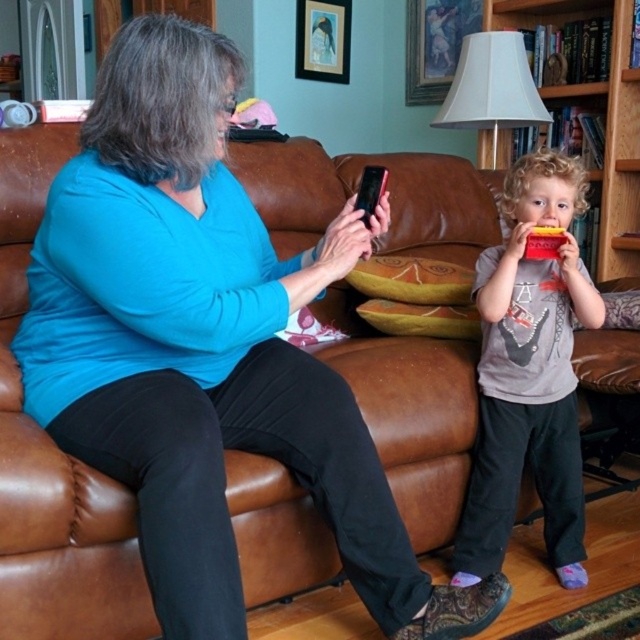
Question: Does brown leather couch at center have a larger size compared to wooden bookshelf at right?

Choices:
 (A) no
 (B) yes

Answer: (A)

Question: Where is brown leather couch at center located in relation to wooden bookshelf at right in the image?

Choices:
 (A) above
 (B) below

Answer: (B)

Question: Does brown leather couch at center lie behind gray cotton shirt at right?

Choices:
 (A) no
 (B) yes

Answer: (B)

Question: Which of these objects is positioned closest to the wooden bookshelf at right?

Choices:
 (A) brown leather couch at center
 (B) gray cotton shirt at right

Answer: (A)

Question: Which object is positioned farthest from the brown leather couch at center?

Choices:
 (A) gray cotton shirt at right
 (B) wooden bookshelf at right

Answer: (B)

Question: Estimate the real-world distances between objects in this image. Which object is closer to the wooden bookshelf at right?

Choices:
 (A) gray cotton shirt at right
 (B) brown leather couch at center

Answer: (B)